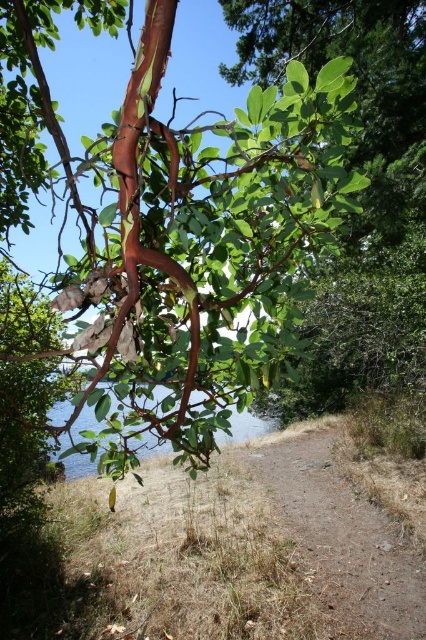
Between point (158, 218) and point (336, 474), which one is positioned behind?

Point (336, 474)

Between smooth reddish-brown branch at upper center and dried grass at center, which one is positioned lower?

dried grass at center

Does point (126, 445) come in front of point (397, 554)?

That is True.

Where is `smooth reddish-brown branch at upper center`? The height and width of the screenshot is (640, 426). smooth reddish-brown branch at upper center is located at coordinates (181, 230).

Between point (345, 524) and point (226, 442), which one is positioned in front?

Positioned in front is point (345, 524).

Can you confirm if dried grass at center is shorter than clear water at lower center?

Correct, dried grass at center is not as tall as clear water at lower center.

Who is more distant from viewer, (371, 598) or (101, 424)?

The point (101, 424) is more distant.

Find the location of `dried grass at center`. dried grass at center is located at coordinates (339, 532).

Is smooth reddish-brown branch at upper center closer to the viewer compared to clear water at lower center?

Yes, it is in front of clear water at lower center.

Does point (22, 148) lie behind point (66, 436)?

That is False.

The height and width of the screenshot is (640, 426). What do you see at coordinates (181, 230) in the screenshot?
I see `smooth reddish-brown branch at upper center` at bounding box center [181, 230].

This screenshot has height=640, width=426. Find the location of `smooth reddish-brown branch at upper center`. smooth reddish-brown branch at upper center is located at coordinates (181, 230).